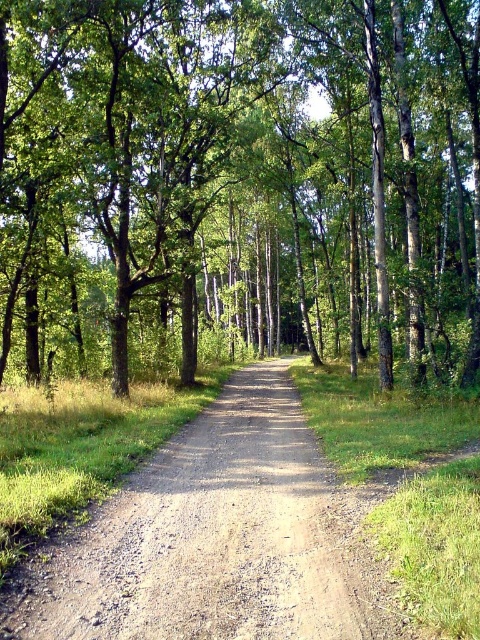
Question: Is green leafy tree at center further to camera compared to brown gravel road at center?

Choices:
 (A) yes
 (B) no

Answer: (A)

Question: Which object is closer to the camera taking this photo?

Choices:
 (A) brown gravel road at center
 (B) green leafy tree at center

Answer: (A)

Question: Is green leafy tree at center below brown gravel road at center?

Choices:
 (A) yes
 (B) no

Answer: (B)

Question: Among these objects, which one is farthest from the camera?

Choices:
 (A) brown gravel road at center
 (B) green leafy tree at center

Answer: (B)

Question: Which point is closer to the camera?

Choices:
 (A) (304, 513)
 (B) (183, 378)

Answer: (A)

Question: Is the position of green leafy tree at center more distant than that of brown gravel road at center?

Choices:
 (A) no
 (B) yes

Answer: (B)